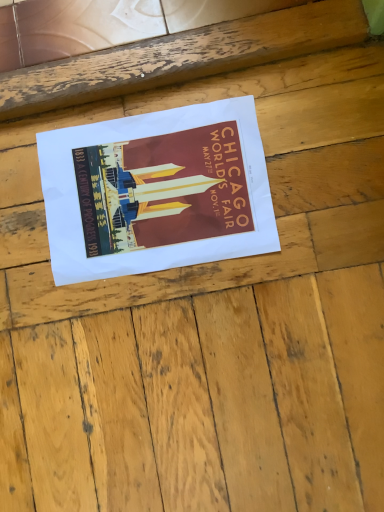
Question: Is wooden at center bigger or smaller than matte paper poster at center?

Choices:
 (A) big
 (B) small

Answer: (A)

Question: In the image, is wooden at center on the left side or the right side of matte paper poster at center?

Choices:
 (A) right
 (B) left

Answer: (A)

Question: Considering their positions, is wooden at center located in front of or behind matte paper poster at center?

Choices:
 (A) behind
 (B) front

Answer: (B)

Question: In the image, is matte paper poster at center on the left side or the right side of wooden at center?

Choices:
 (A) left
 (B) right

Answer: (A)

Question: From a real-world perspective, is matte paper poster at center physically located above or below wooden at center?

Choices:
 (A) above
 (B) below

Answer: (B)

Question: From the image's perspective, is matte paper poster at center positioned above or below wooden at center?

Choices:
 (A) above
 (B) below

Answer: (A)

Question: Does point (72, 128) appear closer or farther from the camera than point (3, 475)?

Choices:
 (A) closer
 (B) farther

Answer: (B)